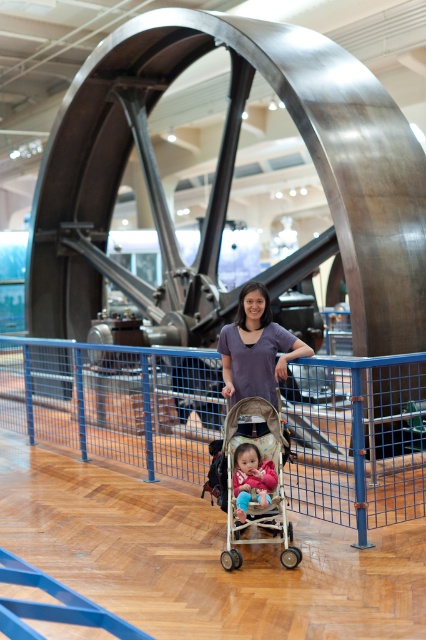
You are standing at the entrance of the museum and want to reach the blue metal rail at center. According to the image, in which direction should you move relative to your current position?

The blue metal rail at center is located at point coordinates, so you should move towards the center of the image to reach it.

You are a parent with a stroller. You want to push your child through a gap between the blue metal rail at center and the pink fabric toddler at center. Can you pass through?

The blue metal rail at center is not as tall as the pink fabric toddler at center, so the rail is shorter. Since the rail is shorter, it might not block the height required for the stroller to pass. However, the description does not provide specific height measurements, so it is uncertain if the stroller can pass through safely. Consider checking the clearance before attempting.

In the museum scene, there is a metallic wheel structure in the background and a stroller with a child in the foreground. The stroller is located at point coordinates of [256,481]. If you were standing at the center of the image, would the stroller be to your left or right?

→ The stroller at point coordinates [256,481] is located at the center of the image, so it would be directly in front of you, not to the left or right.